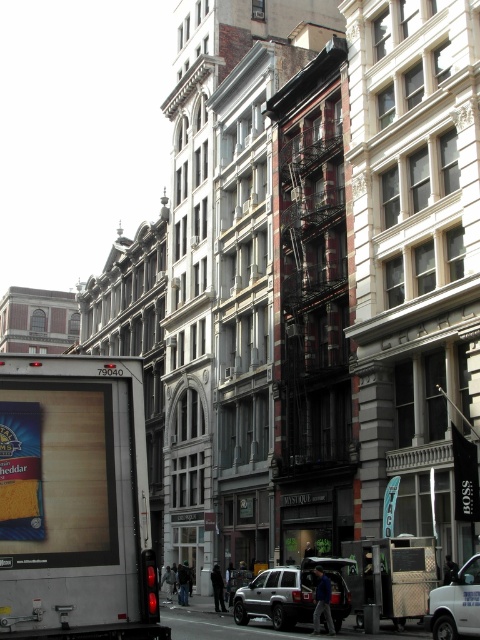
Is the position of silver metallic suv at center more distant than that of metallic silver van at center?

That is True.

Does silver metallic suv at center appear over metallic silver van at center?

Incorrect, silver metallic suv at center is not positioned above metallic silver van at center.

What do you see at coordinates (292, 595) in the screenshot?
I see `silver metallic suv at center` at bounding box center [292, 595].

Identify the location of silver metallic suv at center. (292, 595).

Does yellow cheese at center have a smaller size compared to metallic silver van at center?

No.

Can you confirm if yellow cheese at center is taller than metallic silver van at center?

Indeed, yellow cheese at center has a greater height compared to metallic silver van at center.

Between point (24, 515) and point (435, 611), which one is positioned behind?

The point (435, 611) is behind.

Find the location of a particular element. The image size is (480, 640). yellow cheese at center is located at coordinates (21, 472).

Does blue cardboard cheese at center appear over yellow cheese at center?

No, blue cardboard cheese at center is not above yellow cheese at center.

Is blue cardboard cheese at center positioned before yellow cheese at center?

Yes, it is.

The height and width of the screenshot is (640, 480). Describe the element at coordinates (56, 476) in the screenshot. I see `blue cardboard cheese at center` at that location.

The image size is (480, 640). I want to click on blue cardboard cheese at center, so click(x=56, y=476).